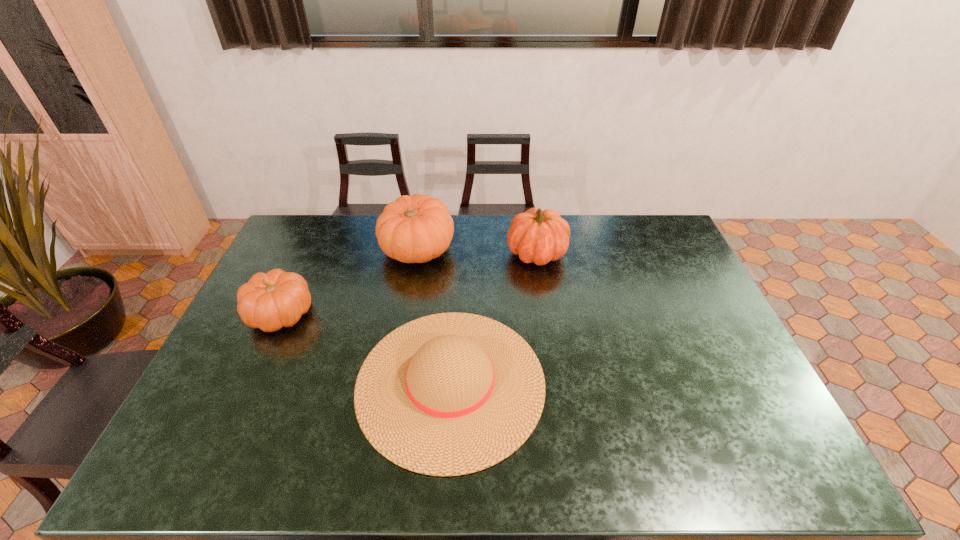
At what (x,y) coordinates should I click in order to perform the action: click on object that is positioned at the left edge. Please return your answer as a coordinate pair (x, y). Looking at the image, I should click on (277, 299).

Locate an element on the screen. vacant area at the far edge of the desktop is located at coordinates (478, 251).

Identify the location of free space at the left edge of the desktop. (292, 254).

Locate an element on the screen. vacant point at the right edge is located at coordinates (675, 276).

The width and height of the screenshot is (960, 540). Identify the location of free space between the leftmost object and the second pumpkin from left to right. (349, 281).

The width and height of the screenshot is (960, 540). I want to click on free space between the nearest pumpkin and the bonnet, so click(366, 348).

You are a GUI agent. You are given a task and a screenshot of the screen. Output one action in this format:
    pyautogui.click(x=<x>, y=<y>)
    Task: Click on the free space between the nearest pumpkin and the rightmost pumpkin
    This screenshot has height=540, width=960.
    Given the screenshot: What is the action you would take?
    pyautogui.click(x=409, y=283)

The width and height of the screenshot is (960, 540). I want to click on blank region between the rightmost pumpkin and the bonnet, so click(493, 318).

Locate an element on the screen. Image resolution: width=960 pixels, height=540 pixels. vacant space that's between the bonnet and the rightmost pumpkin is located at coordinates (493, 318).

This screenshot has height=540, width=960. I want to click on free space between the rightmost pumpkin and the bonnet, so click(493, 318).